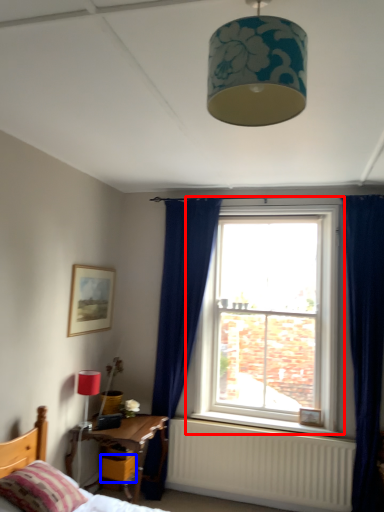
Question: Which object is further to the camera taking this photo, window (highlighted by a red box) or drawer (highlighted by a blue box)?

Choices:
 (A) window
 (B) drawer

Answer: (A)